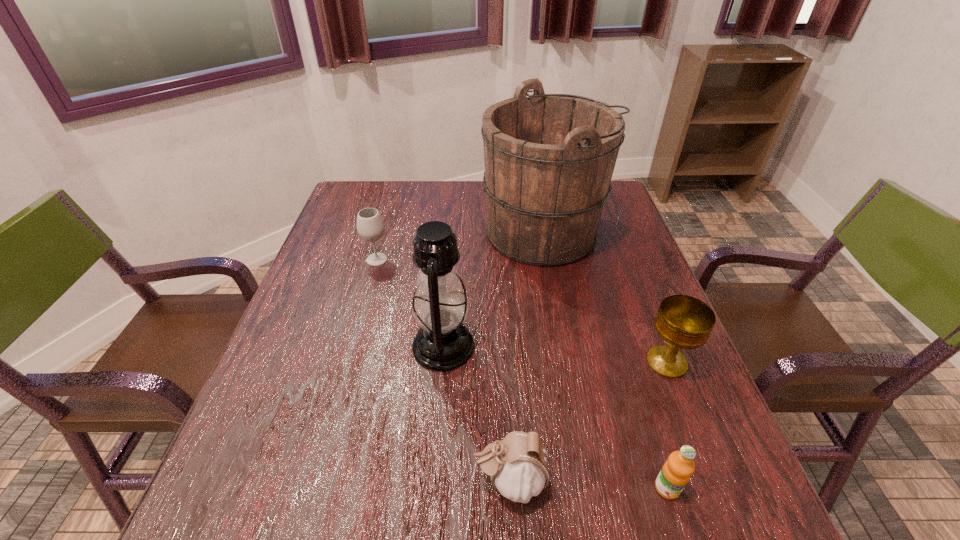
Locate an element on the screen. chalice located in the right edge section of the desktop is located at coordinates (683, 322).

Where is `orange juice at the right edge`? This screenshot has width=960, height=540. orange juice at the right edge is located at coordinates (677, 470).

Where is `object present at the far right corner`? Image resolution: width=960 pixels, height=540 pixels. object present at the far right corner is located at coordinates (549, 158).

This screenshot has height=540, width=960. In order to click on object that is at the near right corner in this screenshot , I will do `click(677, 470)`.

Locate an element on the screen. The width and height of the screenshot is (960, 540). blank area at the far edge is located at coordinates (437, 191).

In the image, there is a desktop. Where is `vacant region at the near edge`? The height and width of the screenshot is (540, 960). vacant region at the near edge is located at coordinates (401, 538).

Identify the location of free space at the left edge of the desktop. This screenshot has width=960, height=540. (294, 444).

I want to click on vacant space at the right edge of the desktop, so click(x=713, y=427).

The height and width of the screenshot is (540, 960). Find the location of `free point at the far left corner`. free point at the far left corner is located at coordinates (381, 187).

The height and width of the screenshot is (540, 960). Identify the location of free space at the near left corner. (230, 496).